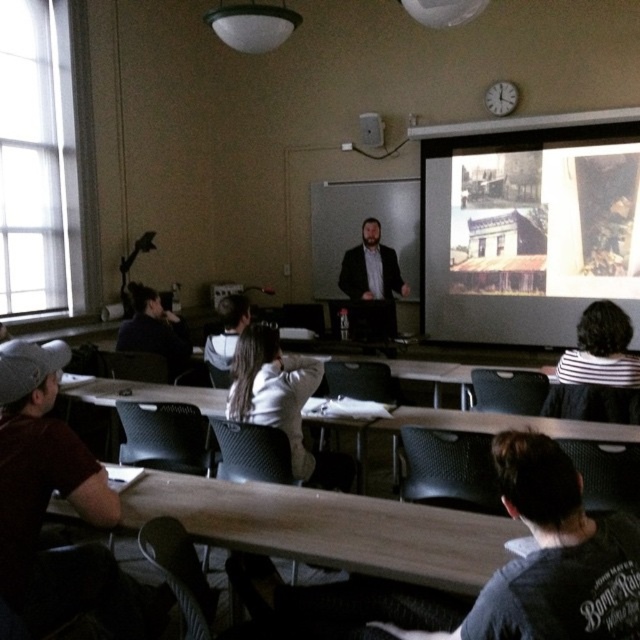
You are a student sitting in the classroom and you want to take a photo of the matte black screen at upper right and the dark brown hair at left. Which object will appear larger in your photo?

The matte black screen at upper right will appear larger in the photo because it is bigger than the dark brown hair at left.